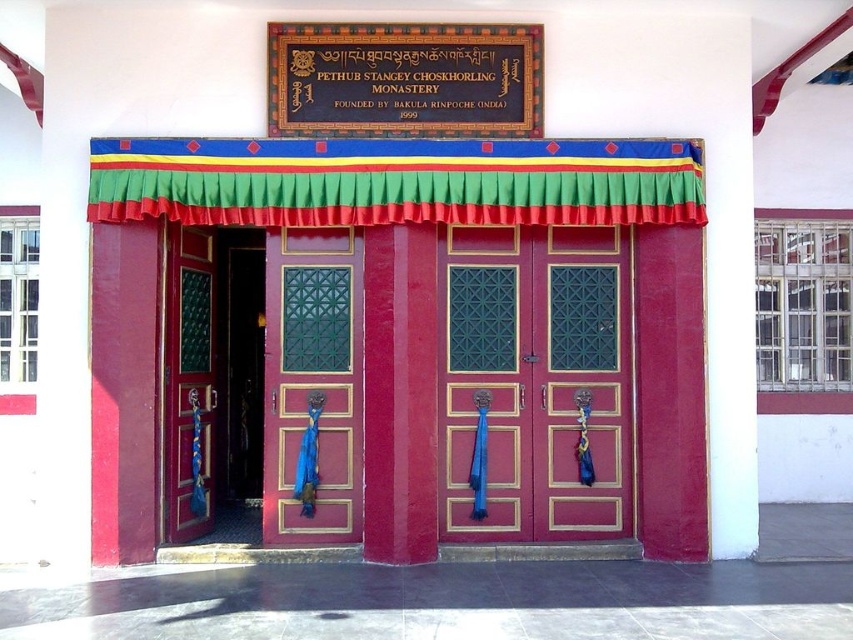
From the picture: Between goldmetallicsignboard at upper center and green glossy door at center, which one is positioned higher?

Positioned higher is goldmetallicsignboard at upper center.

Who is positioned more to the right, goldmetallicsignboard at upper center or green glossy door at center?

goldmetallicsignboard at upper center is more to the right.

Who is more distant from viewer, (393, 28) or (285, 374)?

Positioned behind is point (285, 374).

The height and width of the screenshot is (640, 853). What are the coordinates of `goldmetallicsignboard at upper center` in the screenshot? It's located at (404, 80).

Is matte red wooden door at center below goldmaterial/textureinscription at upper center?

Yes, matte red wooden door at center is below goldmaterial/textureinscription at upper center.

Who is positioned more to the left, matte red wooden door at center or goldmaterial/textureinscription at upper center?

Positioned to the left is goldmaterial/textureinscription at upper center.

Based on the photo, measure the distance between point (512, 456) and camera.

They are 7.32 meters apart.

Identify the location of matte red wooden door at center. The height and width of the screenshot is (640, 853). (537, 381).

Is green fabric curtain at upper center shorter than goldmetallicsignboard at upper center?

Indeed, green fabric curtain at upper center has a lesser height compared to goldmetallicsignboard at upper center.

Is green fabric curtain at upper center bigger than goldmetallicsignboard at upper center?

Result: Yes.

This screenshot has width=853, height=640. Describe the element at coordinates (395, 180) in the screenshot. I see `green fabric curtain at upper center` at that location.

Where is `green fabric curtain at upper center`? green fabric curtain at upper center is located at coordinates (395, 180).